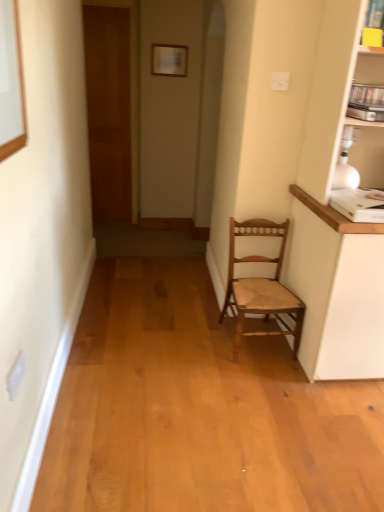
Question: Relative to wooden chair at center, is wooden door at left in front or behind?

Choices:
 (A) front
 (B) behind

Answer: (B)

Question: Considering the positions of wooden door at left and wooden chair at center in the image, is wooden door at left taller or shorter than wooden chair at center?

Choices:
 (A) short
 (B) tall

Answer: (B)

Question: Which of these objects is positioned farthest from the wooden chair at center?

Choices:
 (A) wooden door at left
 (B) matte white picture frame at upper center

Answer: (A)

Question: Which of these objects is positioned farthest from the wooden chair at center?

Choices:
 (A) matte white picture frame at upper center
 (B) wooden door at left

Answer: (B)